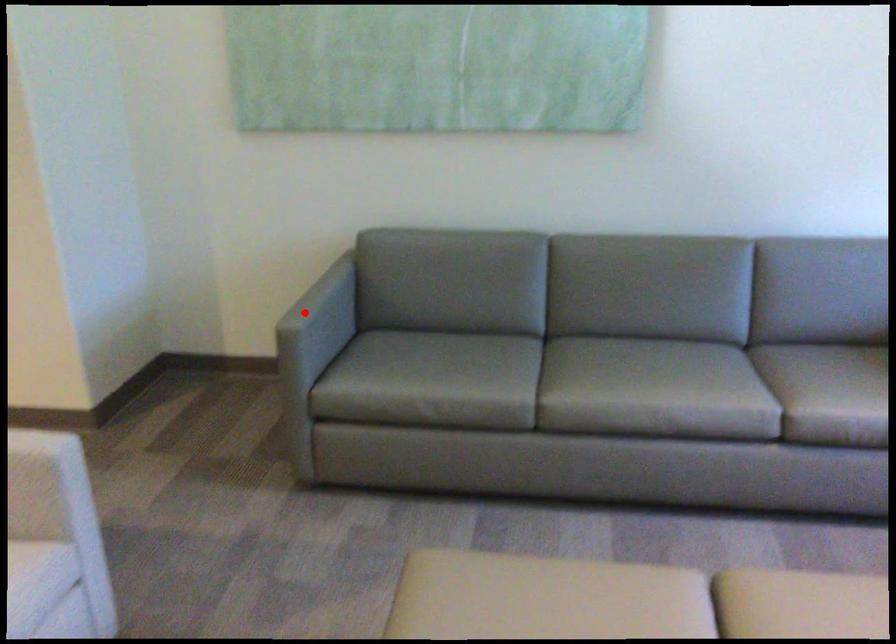
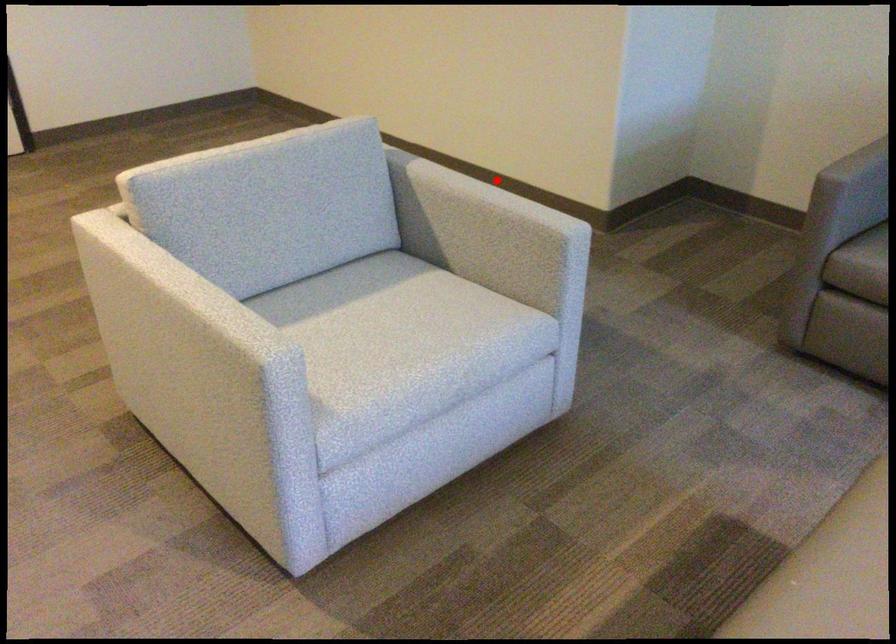
I am providing you with two images of the same scene from different viewpoints. A red point is marked on the first image and another point is marked on the second image. Is the red point in image1 aligned with the point shown in image2?

No